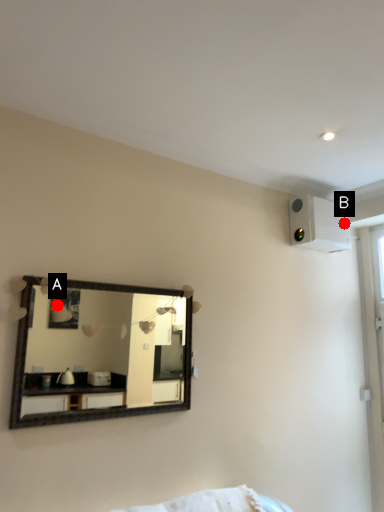
Question: Two points are circled on the image, labeled by A and B beside each circle. Which of the following is the farthest from the observer?

Choices:
 (A) A is further
 (B) B is further

Answer: (B)